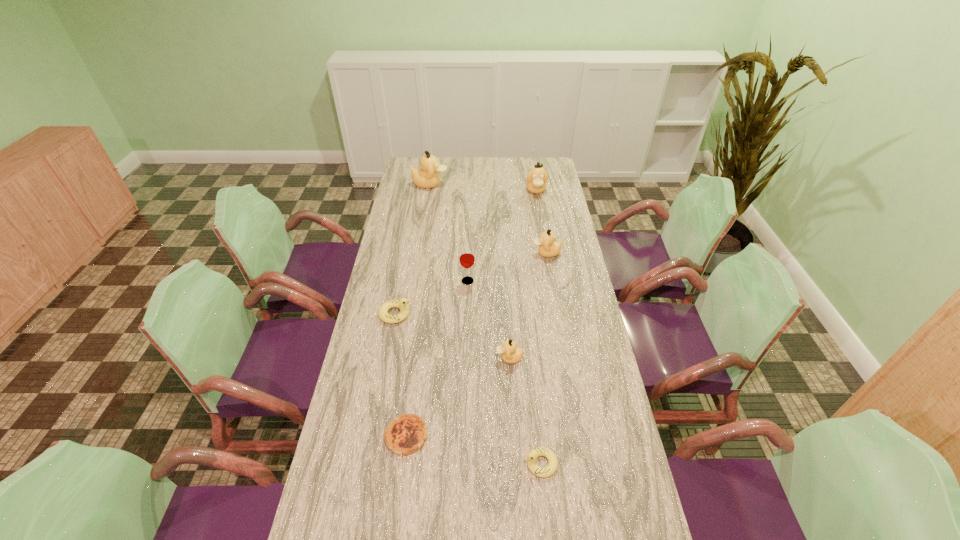
Where is `the tallest duckling`? This screenshot has height=540, width=960. the tallest duckling is located at coordinates (427, 177).

At what (x,y) coordinates should I click in order to perform the action: click on the biggest tan duckling. Please return your answer as a coordinate pair (x, y). The width and height of the screenshot is (960, 540). Looking at the image, I should click on (427, 177).

The height and width of the screenshot is (540, 960). In order to click on the second biggest tan duckling in this screenshot , I will do `click(536, 179)`.

You are a GUI agent. You are given a task and a screenshot of the screen. Output one action in this format:
    pyautogui.click(x=<x>, y=<y>)
    Task: Click on the glass
    This screenshot has width=960, height=540.
    Given the screenshot: What is the action you would take?
    pyautogui.click(x=466, y=258)

Where is `the fifth object from right to left`? the fifth object from right to left is located at coordinates (466, 258).

Find the location of `the fourth shortest duckling`. the fourth shortest duckling is located at coordinates (548, 247).

The width and height of the screenshot is (960, 540). In order to click on the third biggest tan duckling in this screenshot , I will do `click(548, 247)`.

Where is `the second tan duckling from left to right`? This screenshot has width=960, height=540. the second tan duckling from left to right is located at coordinates (511, 354).

Identify the location of the smallest tan duckling. This screenshot has width=960, height=540. (511, 354).

This screenshot has height=540, width=960. What are the coordinates of `the left yellow duckling` in the screenshot? It's located at (402, 304).